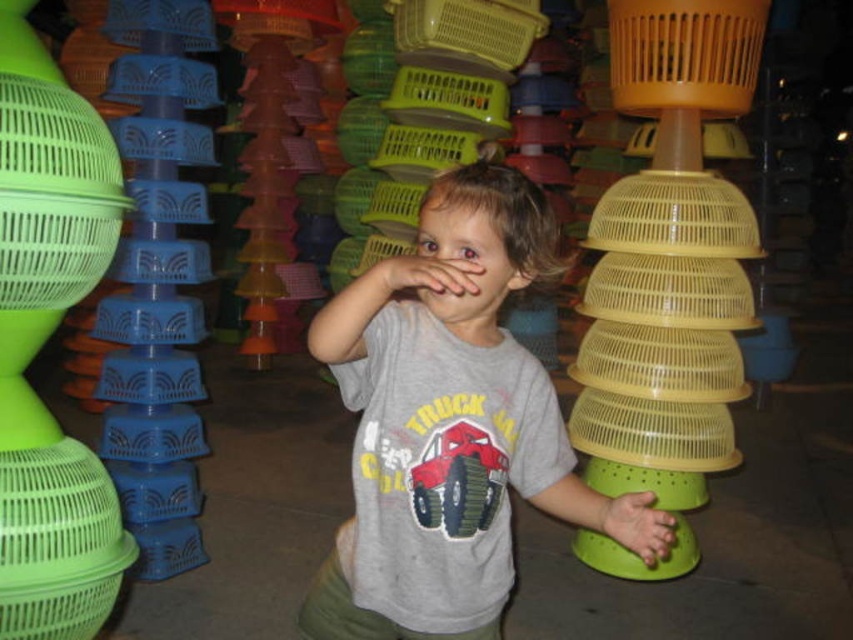
The child is playing with a matte yellow plastic colander at center located at point [669,256]. If the child moves their hand 0.1 units to the right along the x axis, will their hand be closer to the edge of the image?

The matte yellow plastic colander at center is located at point [669,256]. Moving the hand 0.1 units to the right along the x axis would place it at 0.500, 0.785. Since the image edge is at x 1.0, the hand would be further from the edge, so no.

You are a child trying to reach the matte yellow plastic colander at center while holding the matte skin hand at center. Can you grab the colander without moving your hand?

The matte yellow plastic colander at center is to the right of the matte skin hand at center, so you can reach it by extending your arm to the right without moving your hand.

You are a toy designer observing the scene. You need to create a new toy that fits between the green matte hand at lower right and the matte skin hand at center. Which hand should the toy be designed to fit under, considering their sizes?

The green matte hand at lower right is bigger than the matte skin hand at center, so the toy should be designed to fit under the smaller matte skin hand at center to ensure it doesn